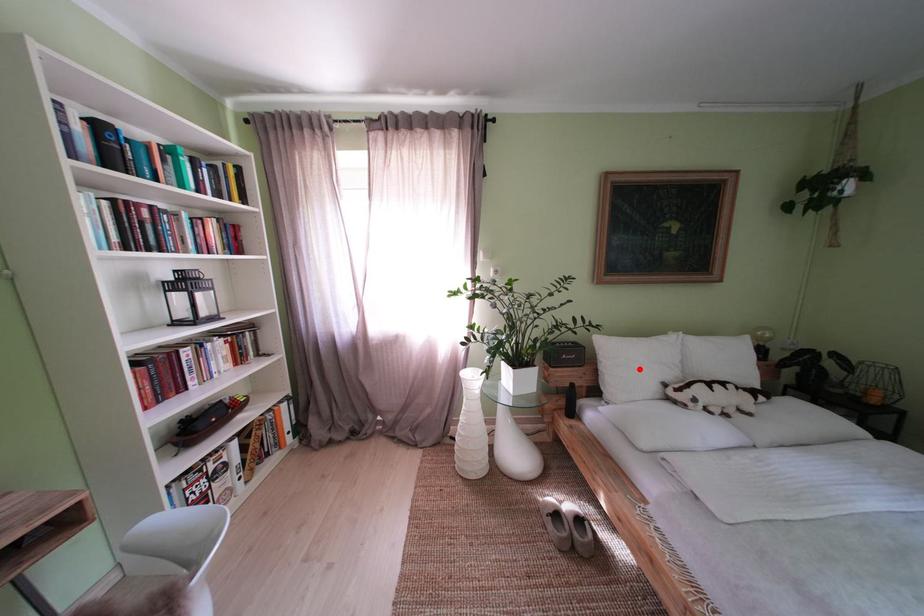
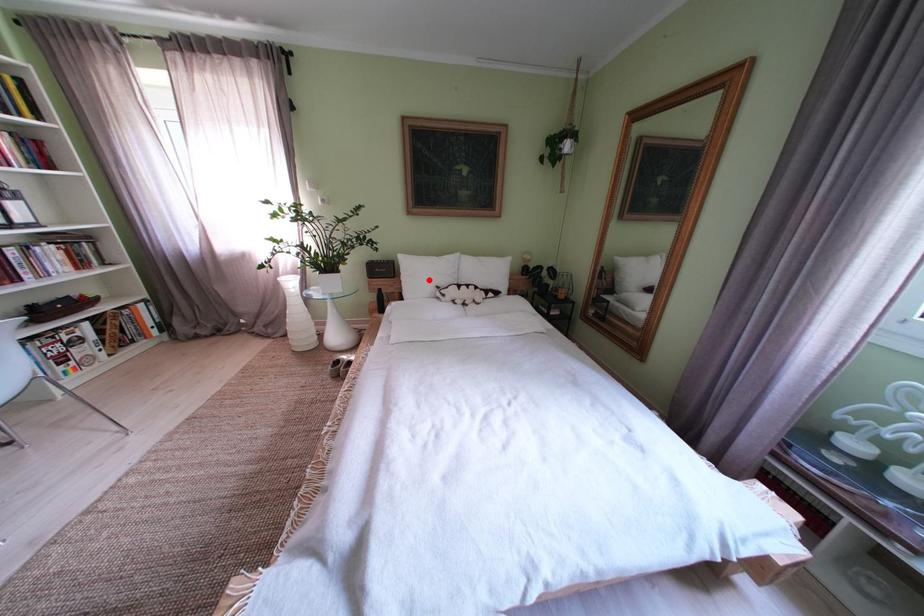
Based on the photo, I am providing you with two images of the same scene from different viewpoints. A red point is marked on the first image and another point is marked on the second image. Are the points marked in image1 and image2 representing the same 3D position?

Yes